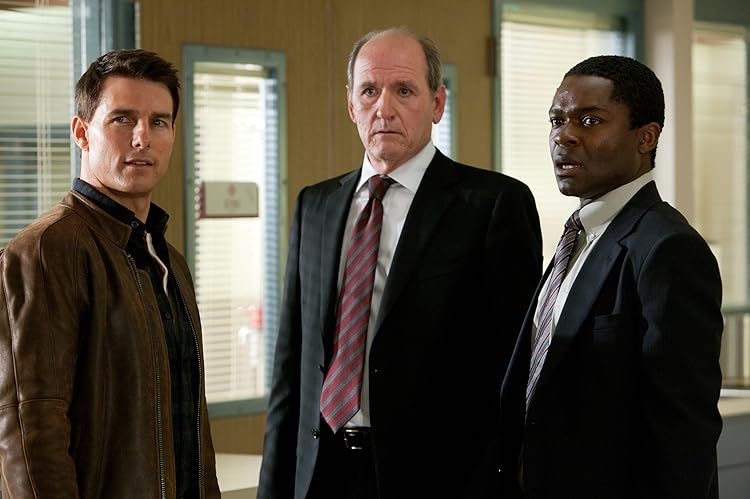
Where is `blinds`? blinds is located at coordinates (39, 71), (520, 84), (712, 113).